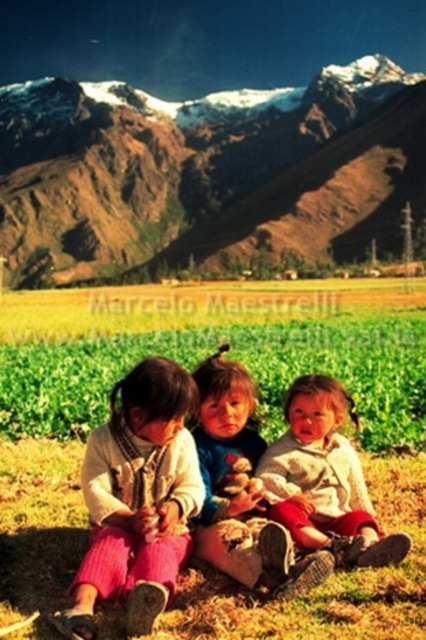
You are a photographer setting up a tripod in this scene. You need to position it so that both the matte pink pants at lower left and the soft beige sweater at center are visible in the frame. Considering their heights, which object should be placed closer to the camera to ensure both are fully visible?

The matte pink pants at lower left has a greater height compared to the soft beige sweater at center. To ensure both are fully visible, the taller matte pink pants at lower left should be placed closer to the camera so that the shorter soft beige sweater at center can be seen without being obscured by the taller object.

You are a photographer trying to capture a closeup of the soft beige sweater at center without including the green grass at center in the frame. Based on their positions, is this possible?

The green grass at center might be wider than the soft beige sweater at center, so it may be challenging to capture the sweater without including some of the grass in the frame.

You are standing at the center of the image and see a point marked at coordinates (138,499). According to the scene description, which object is this point located on?

The point at (138,499) is located on the matte pink pants at lower left.